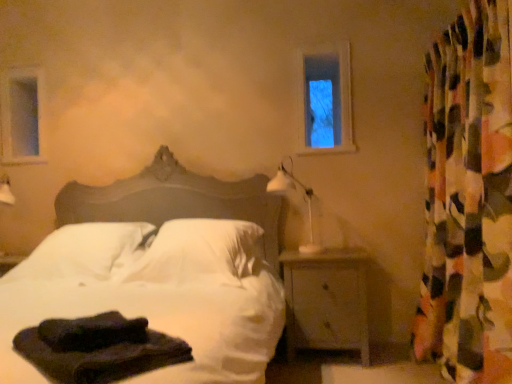
Question: Is multicolored fabric curtain at right taller or shorter than white soft bed at center?

Choices:
 (A) short
 (B) tall

Answer: (B)

Question: Looking at the image, does multicolored fabric curtain at right seem bigger or smaller compared to white soft bed at center?

Choices:
 (A) small
 (B) big

Answer: (A)

Question: Estimate the real-world distances between objects in this image. Which object is closer to the dark fabric at lower left, the first material from the top?

Choices:
 (A) white plastic table lamp at center right
 (B) dark fabric at lower left, which is the first material in bottom-to-top order
 (C) white soft pillow at center, the 2th pillow positioned from the right
 (D) wooden nightstand at lower right
 (E) clear glass window at upper left, which appears as the 2th window frame when viewed from the right

Answer: (B)

Question: Which of these objects is positioned closest to the clear glass window at upper left, marked as the second window frame in a front-to-back arrangement?

Choices:
 (A) dark fabric at lower left, which is the first material in bottom-to-top order
 (B) clear glass window at upper center, placed as the 2th window frame when sorted from left to right
 (C) white soft bed at center
 (D) white soft pillow at center, the 2th pillow positioned from the right
 (E) wooden nightstand at lower right

Answer: (D)